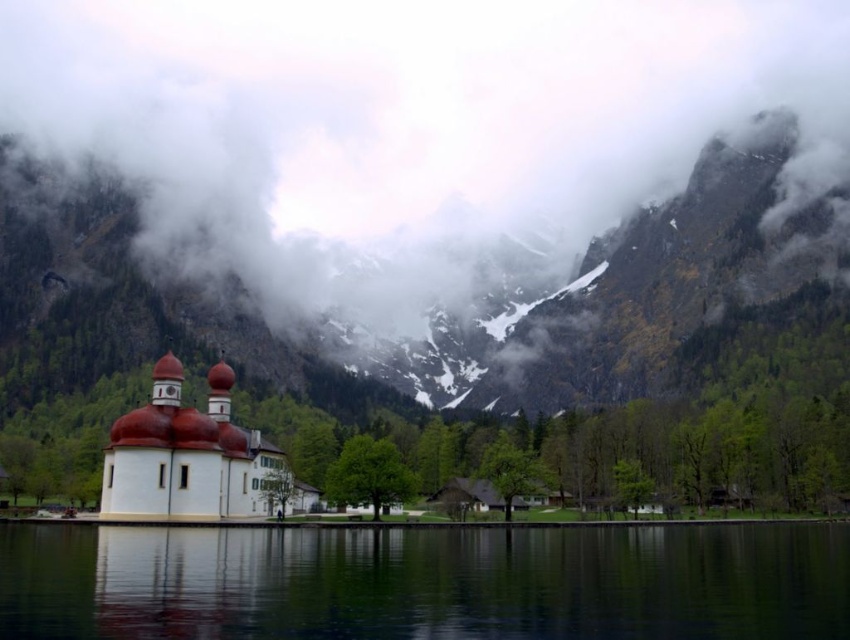
Question: Is transparent glass water at center wider than white matte church at center?

Choices:
 (A) yes
 (B) no

Answer: (A)

Question: Among these points, which one is farthest from the camera?

Choices:
 (A) (222, 208)
 (B) (658, 541)
 (C) (282, 472)

Answer: (A)

Question: Does cloudy fog at upper center come behind white matte church at center?

Choices:
 (A) no
 (B) yes

Answer: (B)

Question: Among these objects, which one is nearest to the camera?

Choices:
 (A) cloudy fog at upper center
 (B) transparent glass water at center
 (C) white matte church at center

Answer: (B)

Question: Which point is farther from the camera taking this photo?

Choices:
 (A) (81, 563)
 (B) (347, 204)

Answer: (B)

Question: Is cloudy fog at upper center below white matte church at center?

Choices:
 (A) yes
 (B) no

Answer: (B)